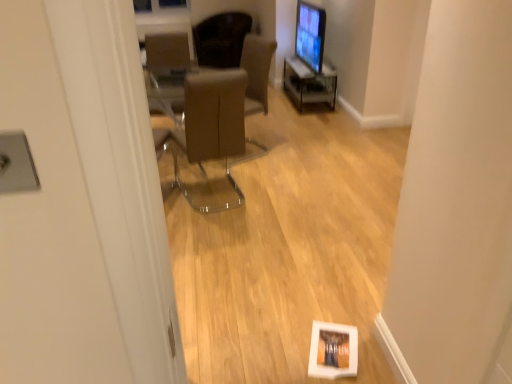
Question: Is the surface of dark brown leather chair at upper center, which is the first chair in top-to-bottom order, in direct contact with matte black monitor at upper right?

Choices:
 (A) yes
 (B) no

Answer: (B)

Question: Is dark brown leather chair at upper center, the third chair when ordered from front to back, oriented away from matte black monitor at upper right?

Choices:
 (A) yes
 (B) no

Answer: (B)

Question: Is the depth of dark brown leather chair at upper center, the first chair viewed from the back, less than that of matte black monitor at upper right?

Choices:
 (A) yes
 (B) no

Answer: (B)

Question: Is matte black monitor at upper right completely or partially inside dark brown leather chair at upper center, the first chair viewed from the back?

Choices:
 (A) yes
 (B) no

Answer: (B)

Question: Can you confirm if dark brown leather chair at upper center, the third chair when ordered from bottom to top, is wider than matte black monitor at upper right?

Choices:
 (A) no
 (B) yes

Answer: (B)

Question: In the image, is dark brown leather chair at upper center, which is the first chair in top-to-bottom order, positioned in front of or behind matte black monitor at upper right?

Choices:
 (A) front
 (B) behind

Answer: (B)

Question: Based on their sizes in the image, would you say dark brown leather chair at upper center, the third chair when ordered from bottom to top, is bigger or smaller than matte black monitor at upper right?

Choices:
 (A) big
 (B) small

Answer: (A)

Question: From their relative heights in the image, would you say dark brown leather chair at upper center, which is the first chair in top-to-bottom order, is taller or shorter than matte black monitor at upper right?

Choices:
 (A) short
 (B) tall

Answer: (A)

Question: Is dark brown leather chair at upper center, the first chair viewed from the back, spatially inside matte black monitor at upper right, or outside of it?

Choices:
 (A) outside
 (B) inside

Answer: (A)

Question: From their relative heights in the image, would you say brown leather chair at center, the third chair positioned from the back, is taller or shorter than matte black monitor at upper right?

Choices:
 (A) tall
 (B) short

Answer: (A)

Question: Do you think brown leather chair at center, the first chair when ordered from front to back, is within matte black monitor at upper right, or outside of it?

Choices:
 (A) outside
 (B) inside

Answer: (A)

Question: Considering the relative positions of brown leather chair at center, the third chair positioned from the back, and matte black monitor at upper right in the image provided, is brown leather chair at center, the third chair positioned from the back, to the left or to the right of matte black monitor at upper right?

Choices:
 (A) left
 (B) right

Answer: (A)

Question: From the image's perspective, is brown leather chair at center, the third chair positioned from the top, positioned above or below matte black monitor at upper right?

Choices:
 (A) below
 (B) above

Answer: (A)

Question: Is brown leather chair at center, the third chair positioned from the back, situated inside dark brown leather chair at upper center, the third chair when ordered from front to back, or outside?

Choices:
 (A) inside
 (B) outside

Answer: (B)

Question: Is point (206, 208) positioned closer to the camera than point (234, 44)?

Choices:
 (A) closer
 (B) farther

Answer: (A)